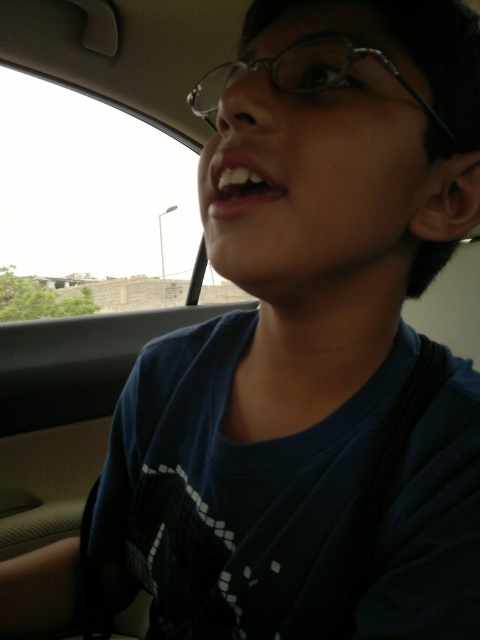
Question: Is clear plastic glasses at upper center to the right of white glossy teeth at upper center from the viewer's perspective?

Choices:
 (A) yes
 (B) no

Answer: (A)

Question: Which object appears closest to the camera in this image?

Choices:
 (A) clear plastic glasses at upper center
 (B) white glossy teeth at upper center

Answer: (A)

Question: Among these objects, which one is nearest to the camera?

Choices:
 (A) white glossy teeth at upper center
 (B) clear plastic glasses at upper center

Answer: (B)

Question: Where is clear plastic glasses at upper center located in relation to white glossy teeth at upper center in the image?

Choices:
 (A) above
 (B) below

Answer: (A)

Question: Can you confirm if clear plastic glasses at upper center is positioned above white glossy teeth at upper center?

Choices:
 (A) no
 (B) yes

Answer: (B)